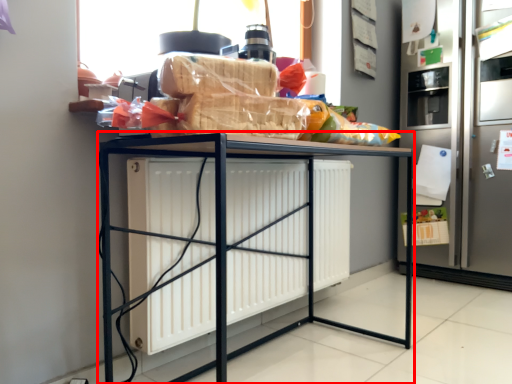
Question: From the image's perspective, what is the correct spatial relationship of furniture (annotated by the red box) in relation to fridge?

Choices:
 (A) above
 (B) below

Answer: (B)